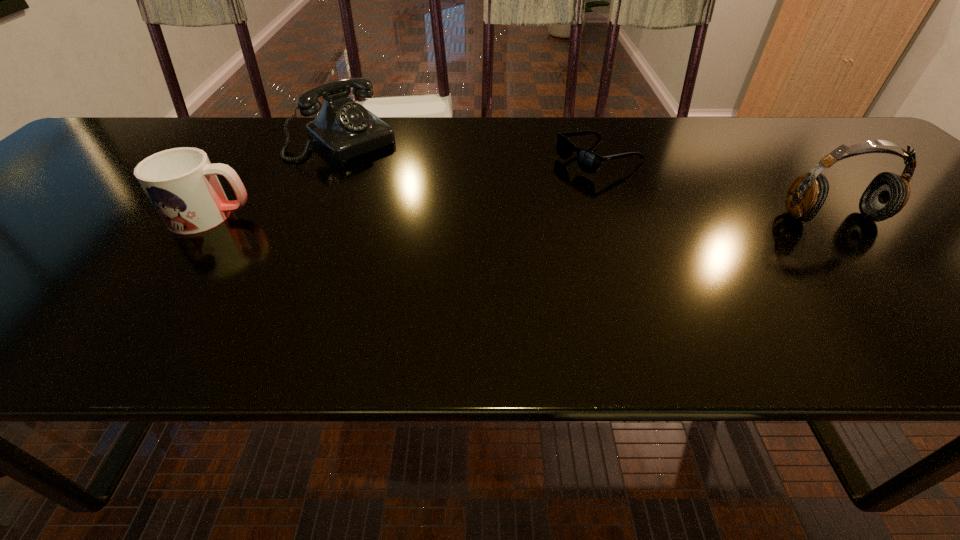
This screenshot has height=540, width=960. In order to click on mug in this screenshot , I will do `click(181, 183)`.

Locate an element on the screen. The image size is (960, 540). the rightmost object is located at coordinates (886, 195).

What are the coordinates of `the tallest object` in the screenshot? It's located at (886, 195).

Where is `sunglasses`? Image resolution: width=960 pixels, height=540 pixels. sunglasses is located at coordinates (588, 161).

Locate an element on the screen. the third object from left to right is located at coordinates (588, 161).

Where is `telephone`? The height and width of the screenshot is (540, 960). telephone is located at coordinates (343, 129).

This screenshot has height=540, width=960. I want to click on free space located 0.210m on the side of the mug with the handle, so click(351, 215).

Where is `free spot located 0.170m on the ear cups of the tallest object`? free spot located 0.170m on the ear cups of the tallest object is located at coordinates (898, 289).

Image resolution: width=960 pixels, height=540 pixels. Identify the location of vacant space located 0.240m on the front-facing side of the second object from right to left. pyautogui.click(x=488, y=204).

Locate an element on the screen. blank area located 0.260m on the front-facing side of the second object from right to left is located at coordinates (481, 207).